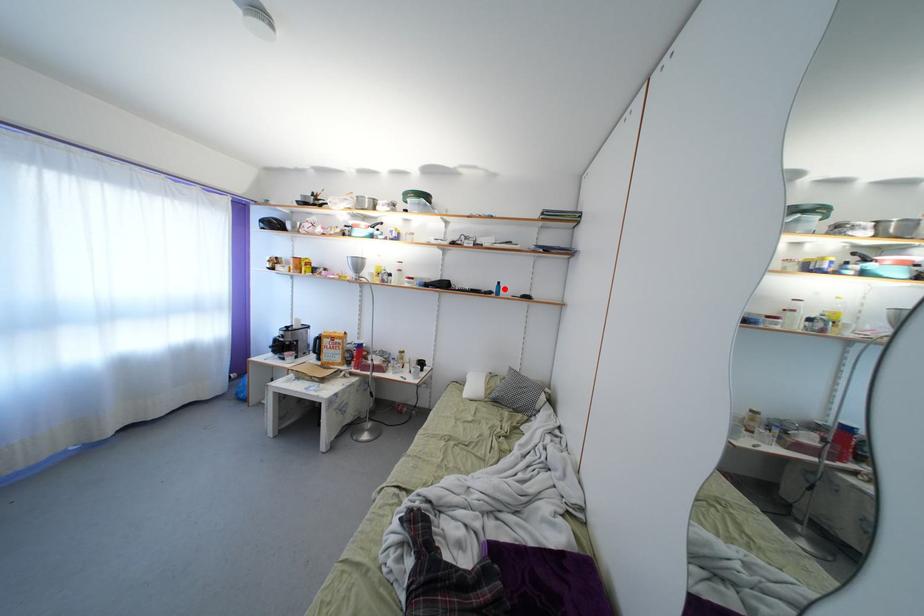
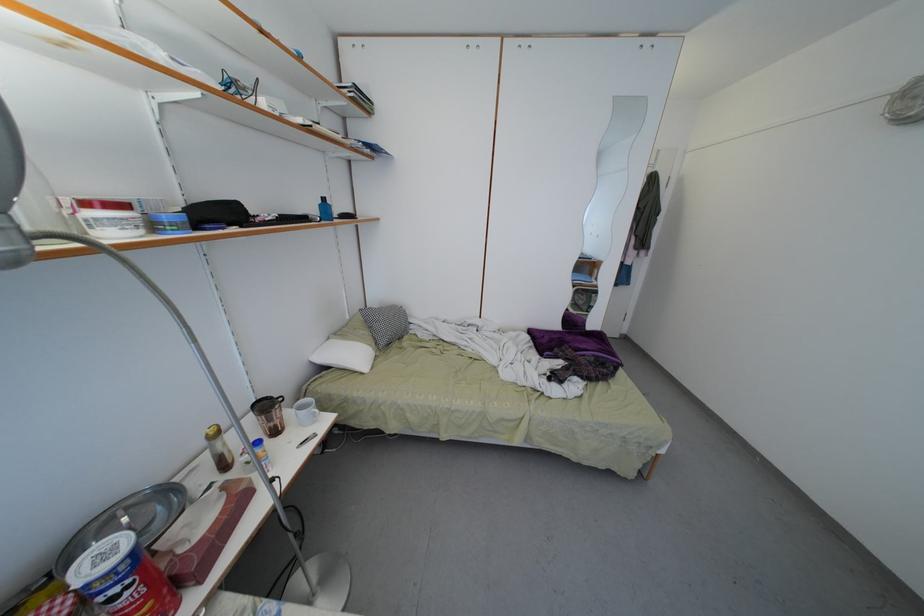
The point at the highlighted location is marked in the first image. Where is the corresponding point in the second image?

(330, 205)